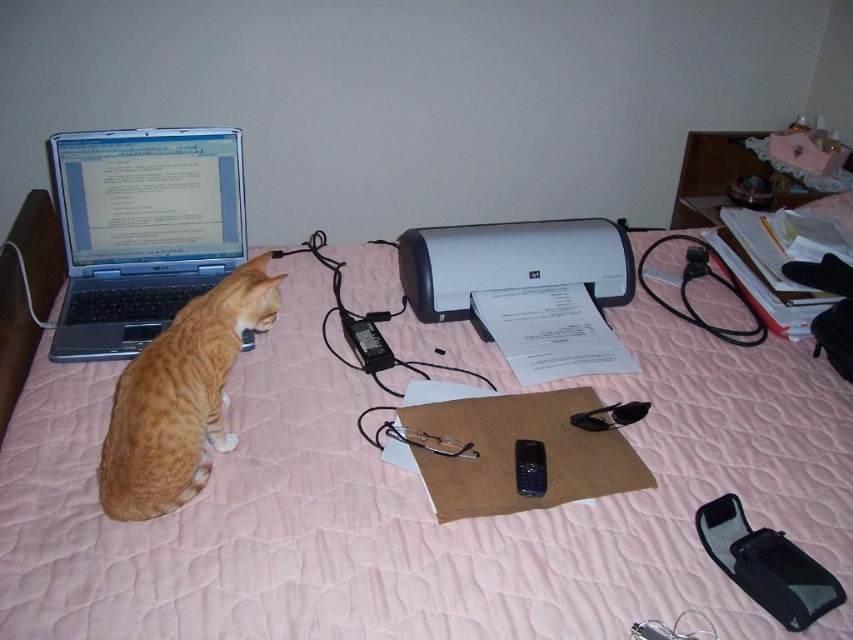
You are a delivery robot trying to place a package on the bed without disturbing the orange fur cat at left. Where should you place the package?

The orange fur cat at left is located at point (180, 397), so you should place the package away from that coordinate to avoid disturbing it.